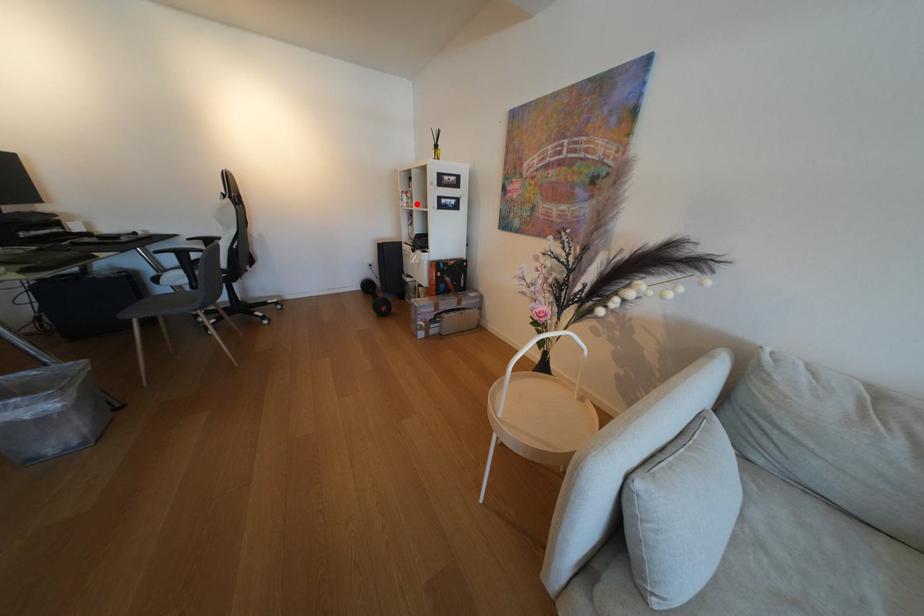
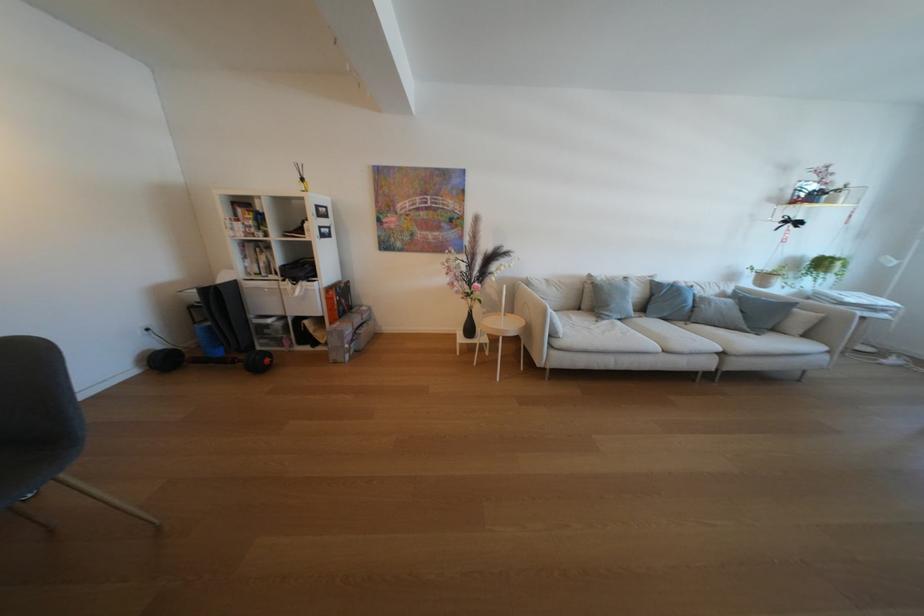
Question: I am providing you with two images of the same scene from different viewpoints. A red point is shown in image1. For the corresponding object point in image2, is it positioned nearer or farther from the camera?

Choices:
 (A) Nearer
 (B) Farther

Answer: (B)